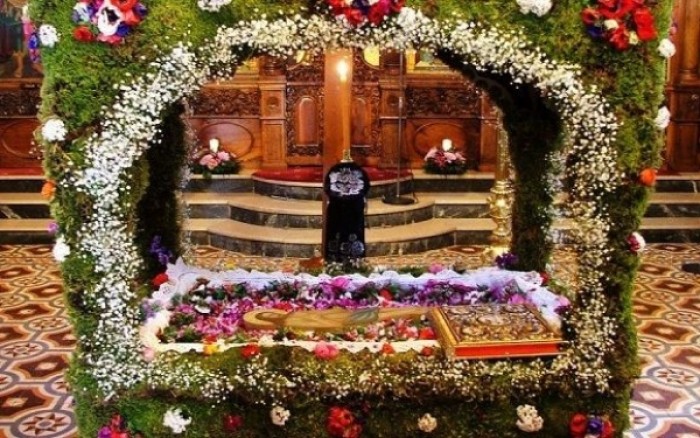
Find the location of a particular element. wall behind altar is located at coordinates (687, 43).